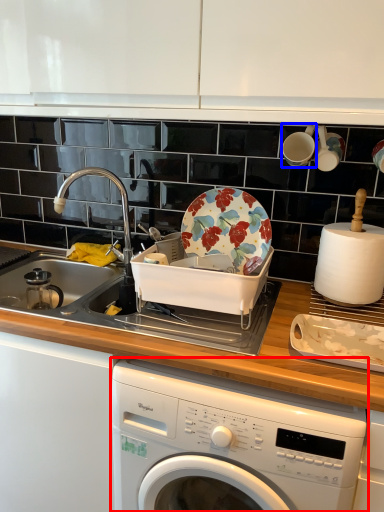
Question: Which of the following is the closest to the observer, washing machine (highlighted by a red box) or tableware (highlighted by a blue box)?

Choices:
 (A) washing machine
 (B) tableware

Answer: (A)